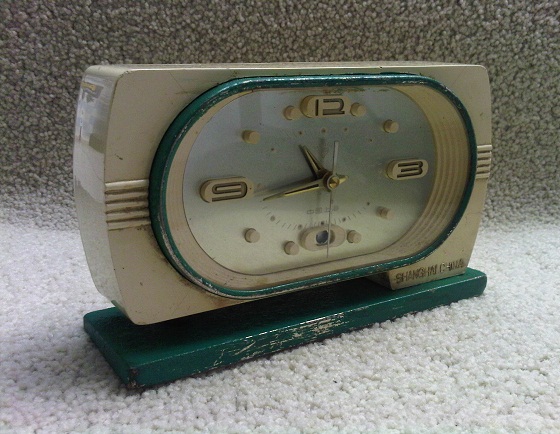
Where is `carpet`? The image size is (560, 434). carpet is located at coordinates (464, 396), (27, 47), (525, 34), (32, 286).